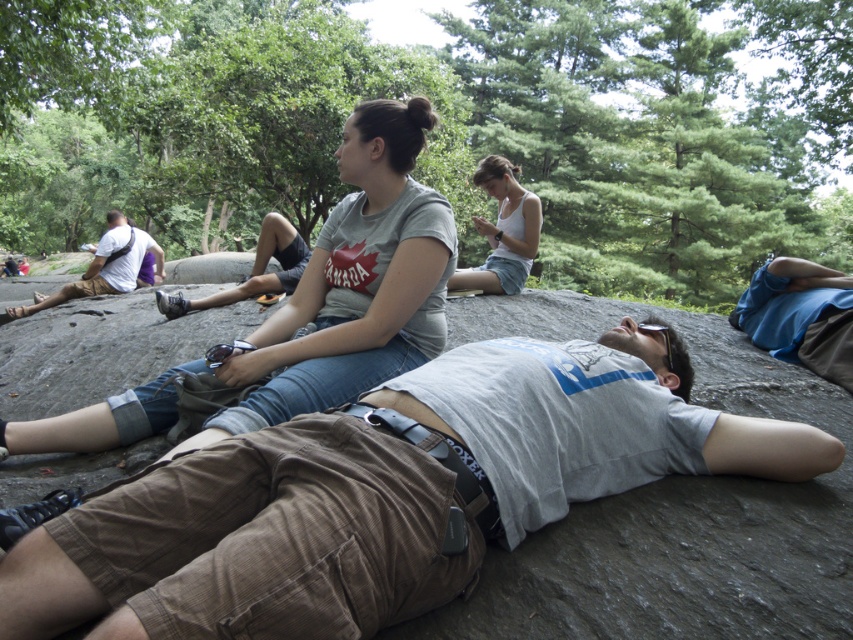
In the scene shown: You are a hiker who needs to retrieve your clear plastic goggles at center to protect your eyes from the sun. Your brown leather backpack at left contains a map. Can you reach the goggles without moving the backpack?

The brown leather backpack at left and clear plastic goggles at center are 6.88 meters apart, so you can reach the goggles without moving the backpack since they are separate items located at different positions.